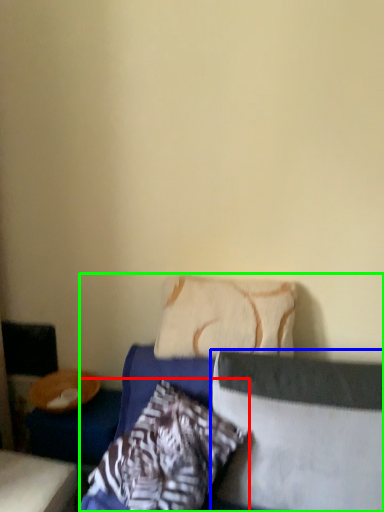
Question: Based on their relative distances, which object is farther from pillow (highlighted by a red box)? Choose from pillow (highlighted by a blue box) and bed (highlighted by a green box).

Choices:
 (A) pillow
 (B) bed

Answer: (A)